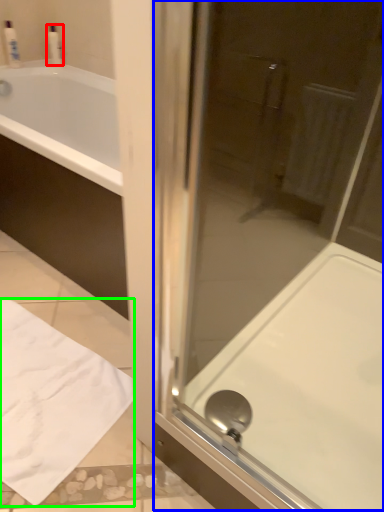
Question: Which object is positioned farthest from toiletry (highlighted by a red box)? Select from screen door (highlighted by a blue box) and sheet (highlighted by a green box).

Choices:
 (A) screen door
 (B) sheet

Answer: (A)